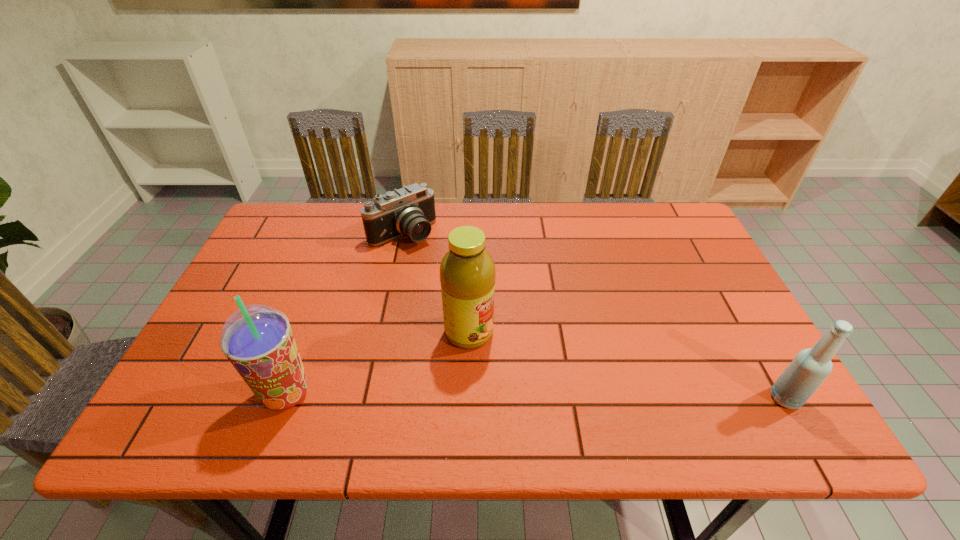
Identify the location of free space on the desktop that is between the smoothie and the rightmost object and is positioned on the front label of the second object from right to left. This screenshot has width=960, height=540. (572, 396).

Where is `vacant space on the desktop that is between the smoothie and the second shortest object and is positioned on the front-facing side of the farthest object`? vacant space on the desktop that is between the smoothie and the second shortest object and is positioned on the front-facing side of the farthest object is located at coordinates [x=564, y=396].